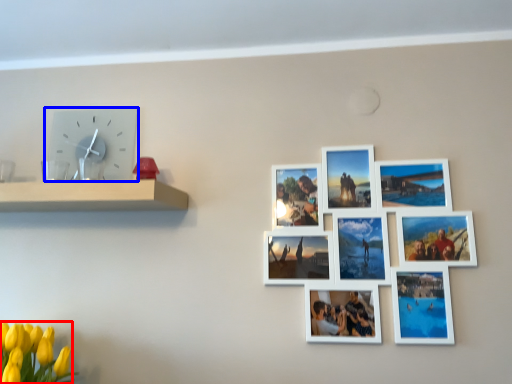
Question: Which of the following is the closest to the observer, flower (highlighted by a red box) or wall clock (highlighted by a blue box)?

Choices:
 (A) flower
 (B) wall clock

Answer: (A)